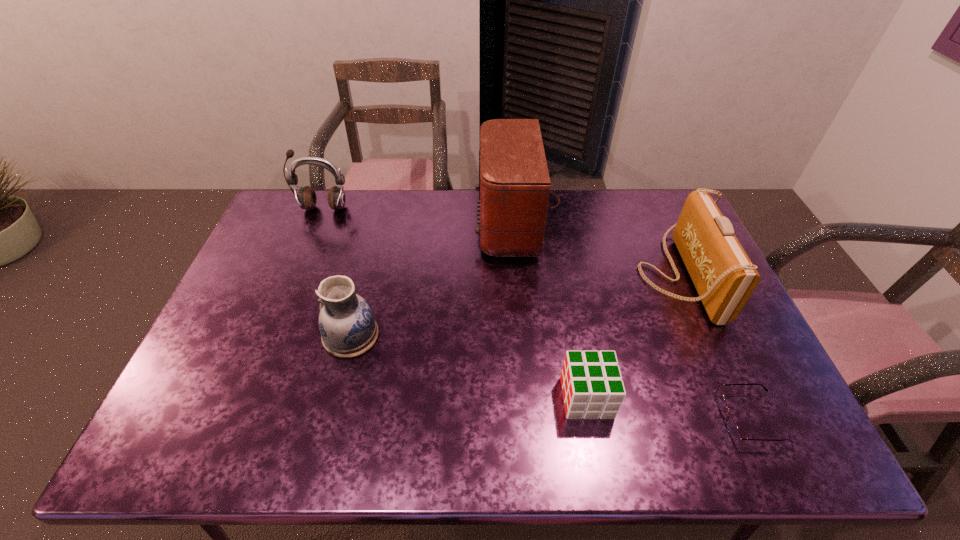
What are the coordinates of `free location at the left edge` in the screenshot? It's located at (251, 339).

Image resolution: width=960 pixels, height=540 pixels. In order to click on vacant space at the right edge of the desktop in this screenshot , I will do `click(708, 335)`.

In the image, there is a desktop. Where is `vacant space at the far left corner`? This screenshot has width=960, height=540. vacant space at the far left corner is located at coordinates click(x=324, y=200).

The height and width of the screenshot is (540, 960). I want to click on free point at the near right corner, so click(x=759, y=442).

You are a GUI agent. You are given a task and a screenshot of the screen. Output one action in this format:
    pyautogui.click(x=<x>, y=<y>)
    Task: Click on the empty space that is in between the earphone and the pottery
    
    Given the screenshot: What is the action you would take?
    pyautogui.click(x=337, y=272)

I want to click on blank region between the shortest object and the radio receiver, so click(636, 321).

Identify the location of blank region between the handbag and the pottery. This screenshot has height=540, width=960. (515, 305).

This screenshot has width=960, height=540. In order to click on free point between the shortest object and the leftmost object in this screenshot , I will do `click(537, 313)`.

This screenshot has width=960, height=540. I want to click on unoccupied area between the handbag and the fifth tallest object, so click(x=633, y=335).

Image resolution: width=960 pixels, height=540 pixels. Find the location of `vacant area that lies between the handbag and the pottery`. vacant area that lies between the handbag and the pottery is located at coordinates (515, 305).